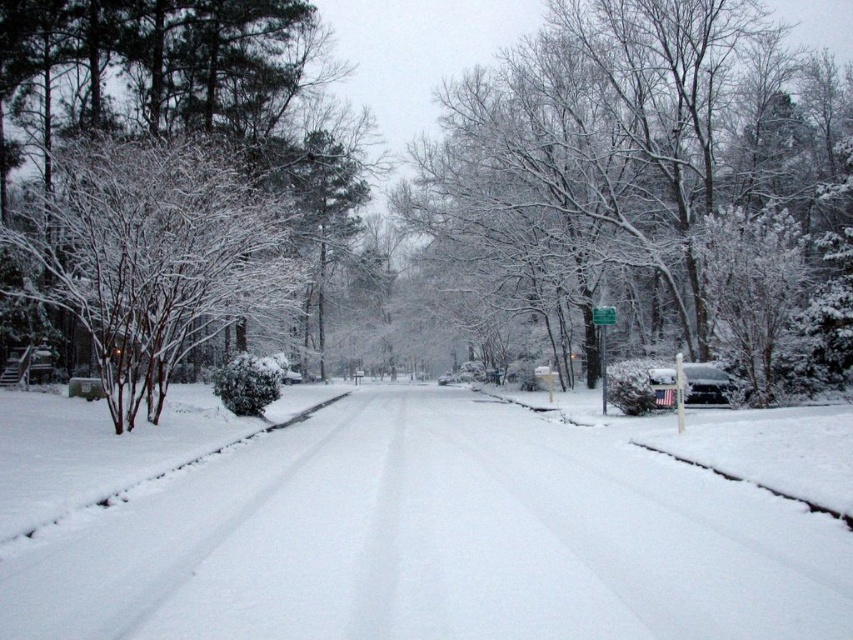
Question: In this image, where is white fluffy snow at center located relative to green plastic sign at center?

Choices:
 (A) right
 (B) left

Answer: (B)

Question: Does green plastic sign at center have a greater width compared to green plastic street sign at center?

Choices:
 (A) no
 (B) yes

Answer: (B)

Question: Which object appears farthest from the camera in this image?

Choices:
 (A) white snow-covered tree at left
 (B) snow-covered tree at center

Answer: (B)

Question: Which is farther from the white snow-covered tree at left?

Choices:
 (A) snow-covered tree at center
 (B) white fluffy snow at center

Answer: (A)

Question: Does green plastic sign at center have a greater width compared to green plastic street sign at center?

Choices:
 (A) yes
 (B) no

Answer: (A)

Question: Based on their relative distances, which object is farther from the green plastic street sign at center?

Choices:
 (A) snow-covered tree at center
 (B) white fluffy snow at center
 (C) sleek black sedan at center
 (D) white snow-covered tree at left

Answer: (D)